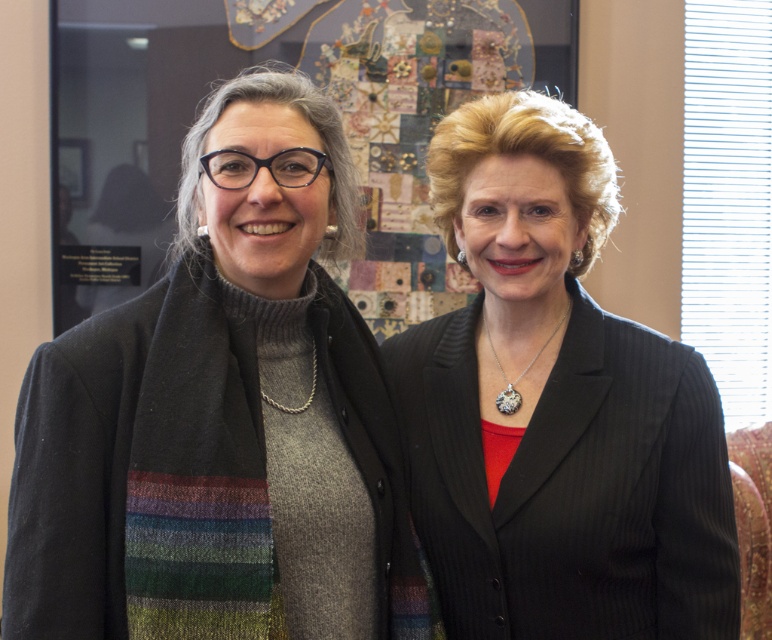
You are a photographer trying to capture a closeup of the knitted scarf at center and the black pinstripe suit at center. Which one should you focus on first if you want to ensure both are in focus without changing the camera settings?

The knitted scarf at center is located above the black pinstripe suit at center. Since the scarf is higher up, focusing on the black pinstripe suit at center first might allow the scarf to stay in focus due to depth of field, but it depends on the camera settings. However, given their proximity, adjusting focus to the middle point between them would be better for both to be in focus.

You are a photographer setting up a shoot in this scene. You need to ensure that both the knitted scarf at center and the black pinstripe suit at center are visible in the frame. Given their sizes, which object should you focus on to ensure both are captured clearly?

The knitted scarf at center is larger in size than the black pinstripe suit at center, so focusing on the knitted scarf at center will help ensure both objects are visible in the frame.